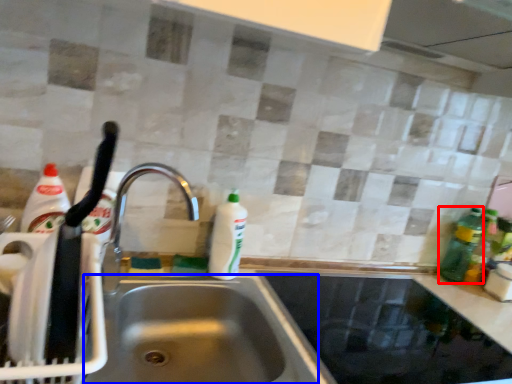
Question: Among these objects, which one is farthest to the camera, bottle (highlighted by a red box) or sink (highlighted by a blue box)?

Choices:
 (A) bottle
 (B) sink

Answer: (A)